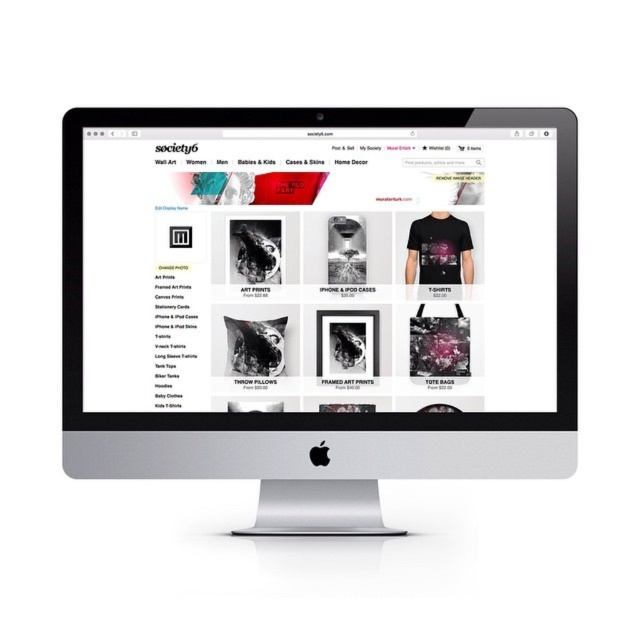
Does silver metallic computer monitor at center have a lesser height compared to black matte t-shirt at center?

No.

Is silver metallic computer monitor at center wider than black matte t-shirt at center?

Yes.

Find the location of a particular element. The image size is (640, 640). silver metallic computer monitor at center is located at coordinates (316, 301).